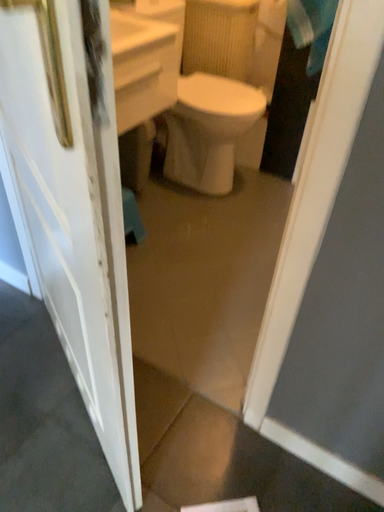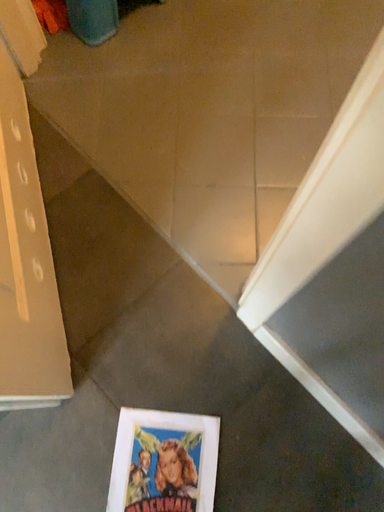
Question: Which way did the camera rotate in the video?

Choices:
 (A) rotated left
 (B) rotated right

Answer: (A)